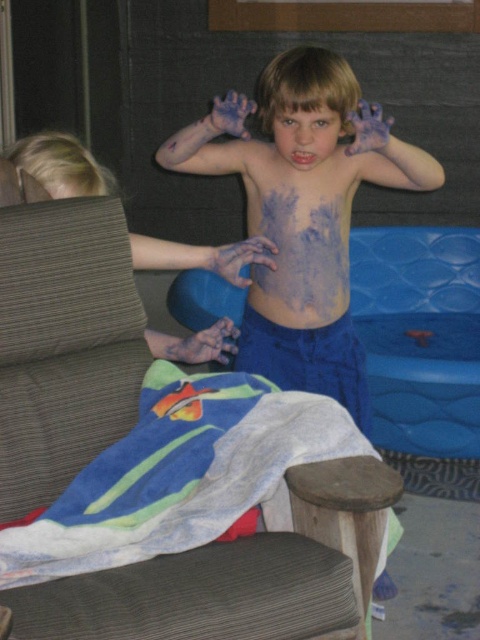
Question: Can you confirm if multicolored towel at lower left is thinner than dark gray fabric armchair at center?

Choices:
 (A) no
 (B) yes

Answer: (A)

Question: Considering the real-world distances, which object is farthest from the smooth skin face at center?

Choices:
 (A) dark gray fabric armchair at center
 (B) blue matte skin at center
 (C) multicolored towel at lower left

Answer: (C)

Question: Which point is farther from the camera taking this photo?

Choices:
 (A) (146, 241)
 (B) (334, 269)
 (C) (141, 474)
 (D) (301, 124)

Answer: (B)

Question: Is blue matte skin at center below dark gray fabric armchair at center?

Choices:
 (A) yes
 (B) no

Answer: (B)

Question: Is blue matte skin at center further to camera compared to multicolored towel at lower left?

Choices:
 (A) yes
 (B) no

Answer: (A)

Question: Estimate the real-world distances between objects in this image. Which object is closer to the multicolored towel at lower left?

Choices:
 (A) blue matte ball at upper center
 (B) dark gray fabric armchair at center
 (C) blue matte skin at center
 (D) smooth skin face at center

Answer: (B)